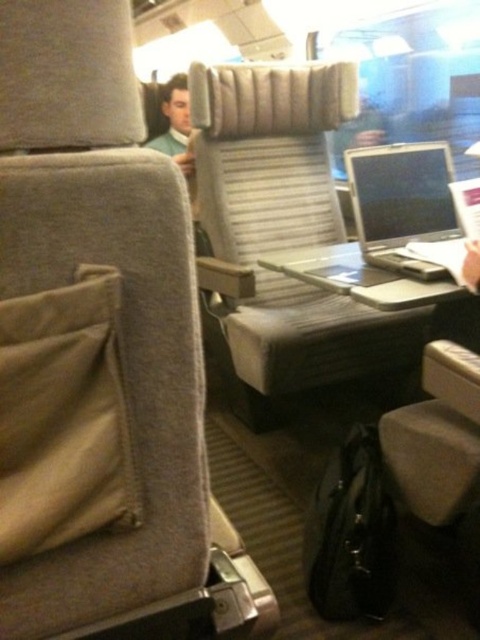
Question: In this image, where is satin silver laptop at center located relative to metallic gray tray at center?

Choices:
 (A) left
 (B) right

Answer: (B)

Question: Is satin silver laptop at center positioned at the back of metallic gray tray at center?

Choices:
 (A) yes
 (B) no

Answer: (A)

Question: Among these points, which one is nearest to the camera?

Choices:
 (A) (368, 241)
 (B) (294, 276)

Answer: (A)

Question: Which point is farther from the camera taking this photo?

Choices:
 (A) click(307, 262)
 (B) click(355, 205)

Answer: (A)

Question: Does satin silver laptop at center appear under metallic gray tray at center?

Choices:
 (A) no
 (B) yes

Answer: (A)